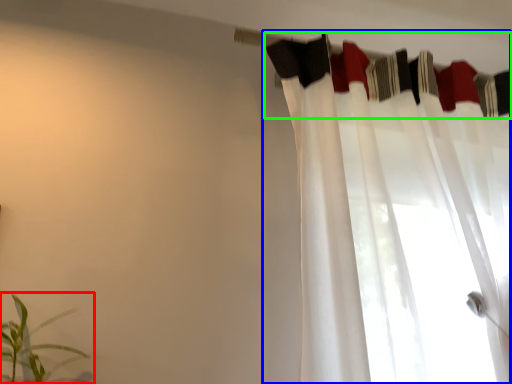
Question: Estimate the real-world distances between objects in this image. Which object is closer to houseplant (highlighted by a red box), curtain (highlighted by a blue box) or clothesline (highlighted by a green box)?

Choices:
 (A) curtain
 (B) clothesline

Answer: (A)